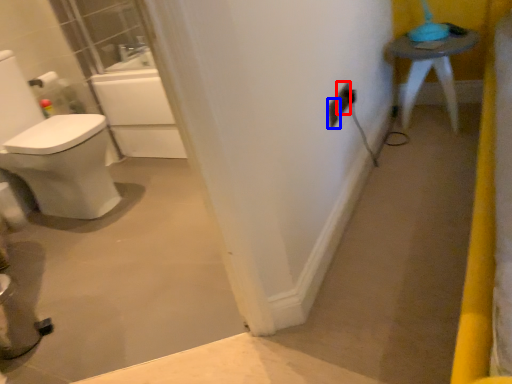
Question: Among these objects, which one is farthest to the camera, electric outlet (highlighted by a red box) or electric outlet (highlighted by a blue box)?

Choices:
 (A) electric outlet
 (B) electric outlet

Answer: (A)